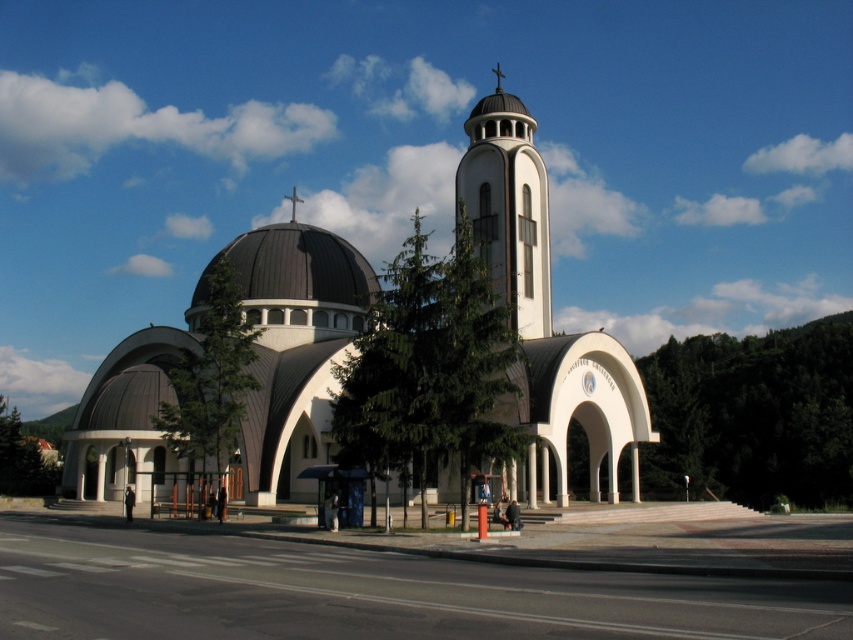
You are an architect designing a new building. You want to ensure that the white smooth church at center is visible from a distance. Given that the black dome at center is part of the same structure, which one would likely be more noticeable when viewed from afar?

The white smooth church at center is much taller than the black dome at center, so it would likely be more noticeable from a distance due to its greater height.

You are standing at the entrance of the modern church and see two points marked on the facade. The first point is at coordinate point (x=115, y=403) and the second is at point (x=469, y=180). Which point is closer to you as you face the building?

Point (x=115, y=403) is in front of point (x=469, y=180), so it is closer to you as you face the building.